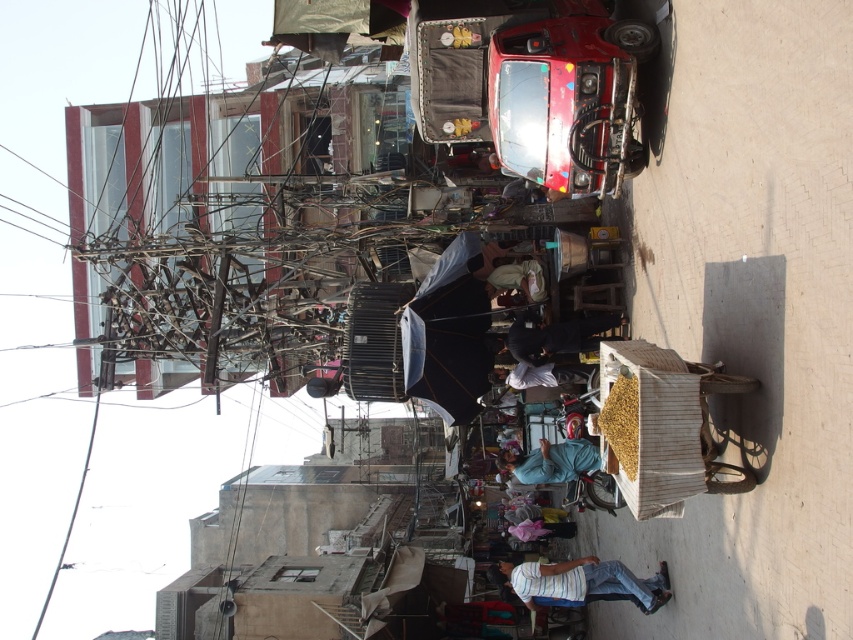
You are a delivery person who needs to place a package between the black fabric at center and the blue fabric at center. The package requires a space of 10 meters. Can you fit it between them?

The black fabric at center and blue fabric at center are 12.06 meters apart from each other, so yes, the package requiring 10 meters can fit between them since the distance is sufficient.

You are a street vendor in the scene and you have two items for sale, a striped cotton shirt at lower center and a black fabric at center. A customer asks which item is on the left side. What do you tell them?

The striped cotton shirt at lower center is positioned on the left side of black fabric at center, so the striped cotton shirt at lower center is the one on the left.

You are a pedestrian standing at the edge of the street looking towards the parked red auto rickshaw. You notice two items in the scene described as the striped cotton shirt at lower center and the blue fabric at center. Which of these two items is positioned closer to the ground?

The striped cotton shirt at lower center is positioned closer to the ground as it is described to be below the blue fabric at center.